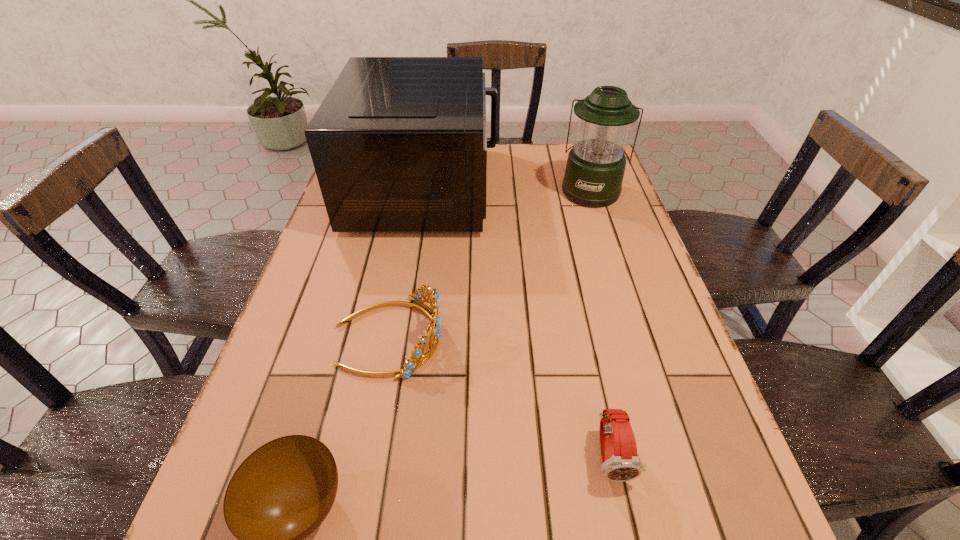
The image size is (960, 540). I want to click on vacant space that satisfies the following two spatial constraints: 1. on the front-facing side of the microwave_oven; 2. on the right side of the lantern, so click(424, 191).

Where is `blank space that satisfies the following two spatial constraints: 1. on the front side of the lantern; 2. on the front-facing side of the third farthest object`? blank space that satisfies the following two spatial constraints: 1. on the front side of the lantern; 2. on the front-facing side of the third farthest object is located at coordinates (638, 336).